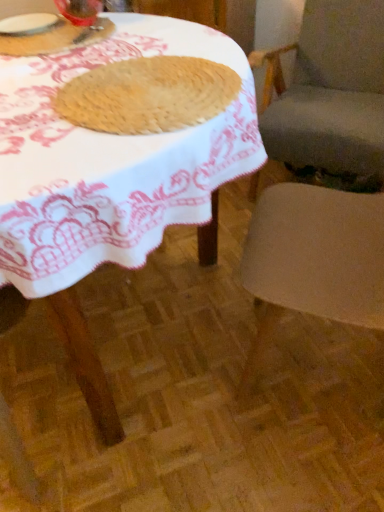
At what (x,y) coordinates should I click in order to perform the action: click on vacant space to the right of transparent glass at upper left, the 1th tableware from the right. Please return your answer as a coordinate pair (x, y). Looking at the image, I should click on (124, 23).